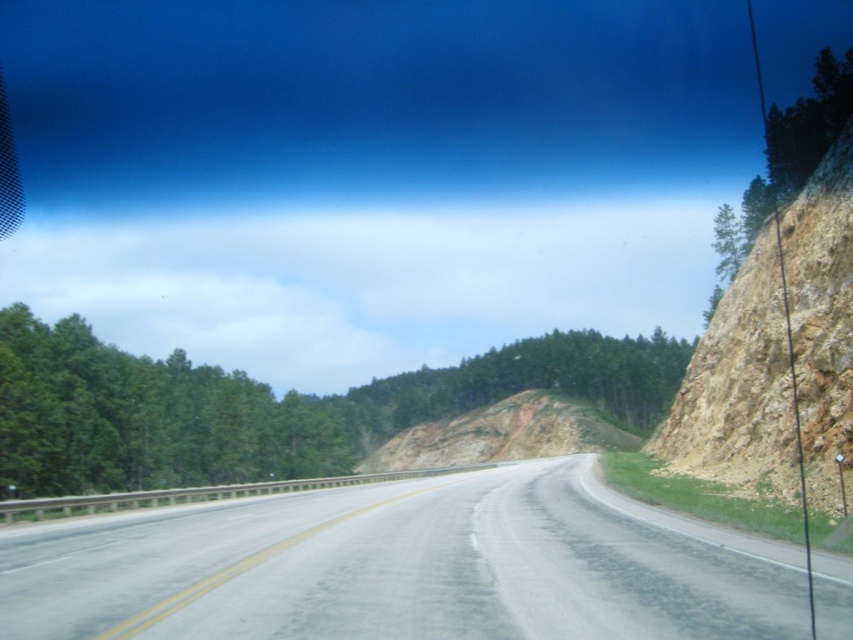
Question: Is brown rocky hillside at right bigger than brown dirt hillside at center?

Choices:
 (A) yes
 (B) no

Answer: (A)

Question: Estimate the real-world distances between objects in this image. Which object is closer to the asphalt road at center?

Choices:
 (A) brown dirt hillside at center
 (B) brown rocky hillside at right

Answer: (B)

Question: Is asphalt road at center thinner than brown dirt hillside at center?

Choices:
 (A) no
 (B) yes

Answer: (B)

Question: Which point is farther to the camera?

Choices:
 (A) brown dirt hillside at center
 (B) asphalt road at center
 (C) brown rocky hillside at right

Answer: (A)

Question: Estimate the real-world distances between objects in this image. Which object is farther from the asphalt road at center?

Choices:
 (A) brown rocky hillside at right
 (B) brown dirt hillside at center

Answer: (B)

Question: Considering the relative positions of brown rocky hillside at right and brown dirt hillside at center in the image provided, where is brown rocky hillside at right located with respect to brown dirt hillside at center?

Choices:
 (A) above
 (B) below

Answer: (A)